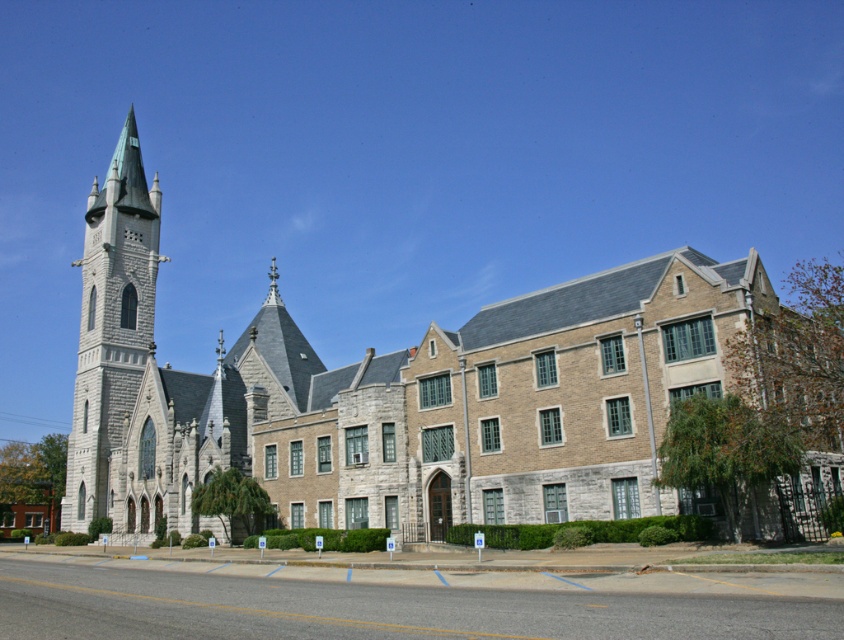
You are standing at the center of the image. Which direction should you look to see the gray stone church at left?

The gray stone church at left is located at point 0.616 on the x axis and 0.464 on the y axis. Since you are at the center, you should look to the left to see the gray stone church at left.

You are standing in front of the gray stone church at left and want to take a photo of the gray stone tower at left. Since the church is in the way, can you move to the right side of the church to get a clear view of the tower?

The gray stone church at left is below the gray stone tower at left. Since the church is positioned lower than the tower, moving to the right side of the church might still allow you to see the tower as long as there are no obstructions. However, the church being below the tower suggests they are part of the same structure, so the tower may be visible from the side.